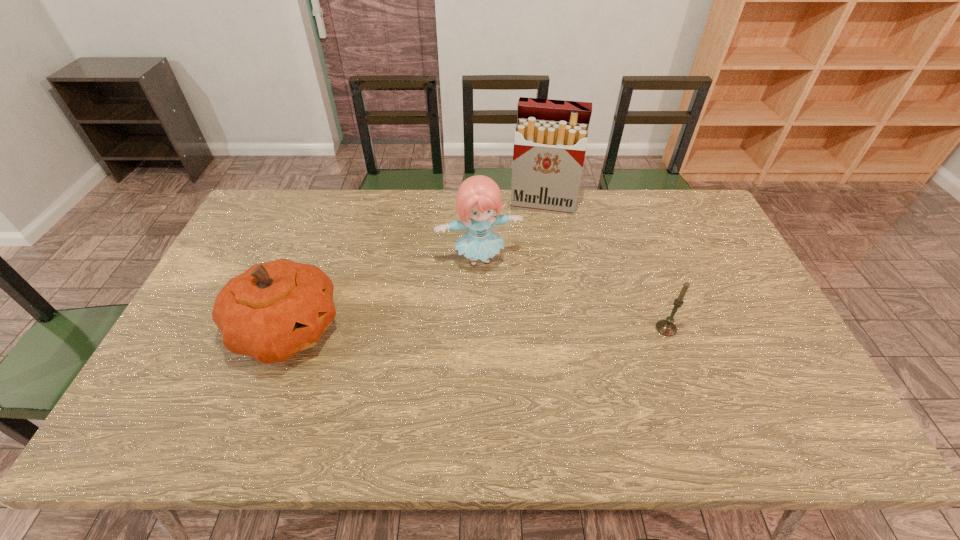
I want to click on pumpkin, so click(x=272, y=311).

Locate an element on the screen. the second shortest object is located at coordinates (272, 311).

Locate an element on the screen. The image size is (960, 540). the shortest object is located at coordinates (666, 327).

At what (x,y) coordinates should I click in order to perform the action: click on candle. Please return your answer as a coordinate pair (x, y). This screenshot has width=960, height=540. Looking at the image, I should click on (666, 327).

I want to click on cigarette case, so click(x=551, y=136).

Locate an element on the screen. the farthest object is located at coordinates (551, 136).

This screenshot has height=540, width=960. Find the location of `the second farthest object`. the second farthest object is located at coordinates (479, 196).

Image resolution: width=960 pixels, height=540 pixels. What are the coordinates of `doll` in the screenshot? It's located at (479, 196).

I want to click on free space located 0.180m on the front-facing side of the pumpkin, so click(409, 330).

This screenshot has width=960, height=540. Identify the location of vacant space located on the back of the rightmost object. (631, 231).